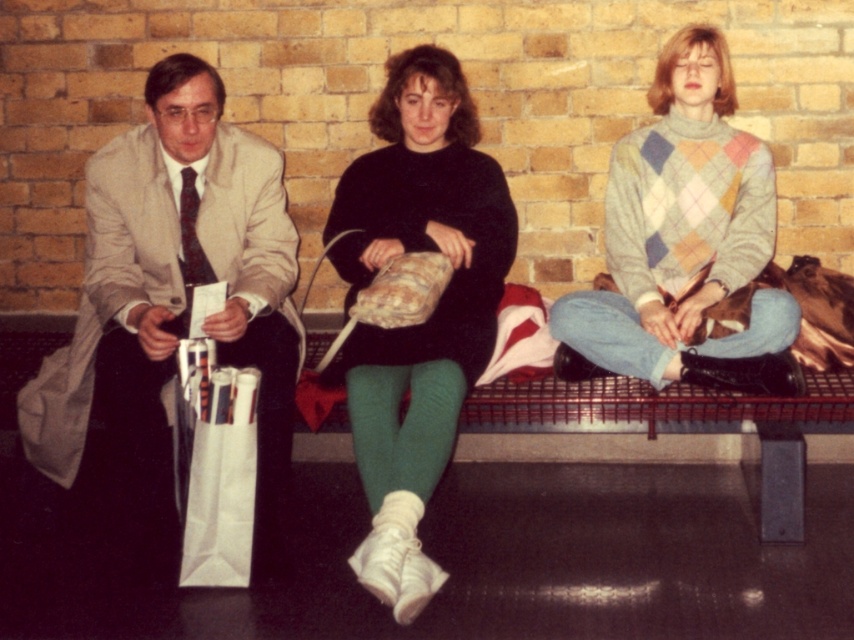
You are standing at the entrance of the station and want to locate the person wearing a matte beige suit at left. According to the coordinates provided, where should you look?

The matte beige suit at left is located at point (168,320).

Consider the image. What is located at the coordinates point (168, 320)?

The point (168, 320) is occupied by the matte beige suit at left.